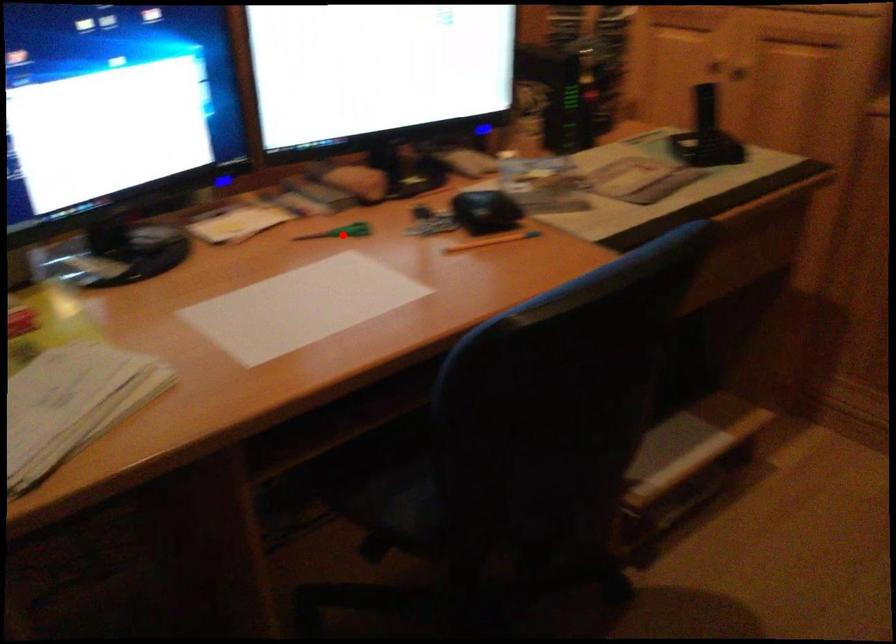
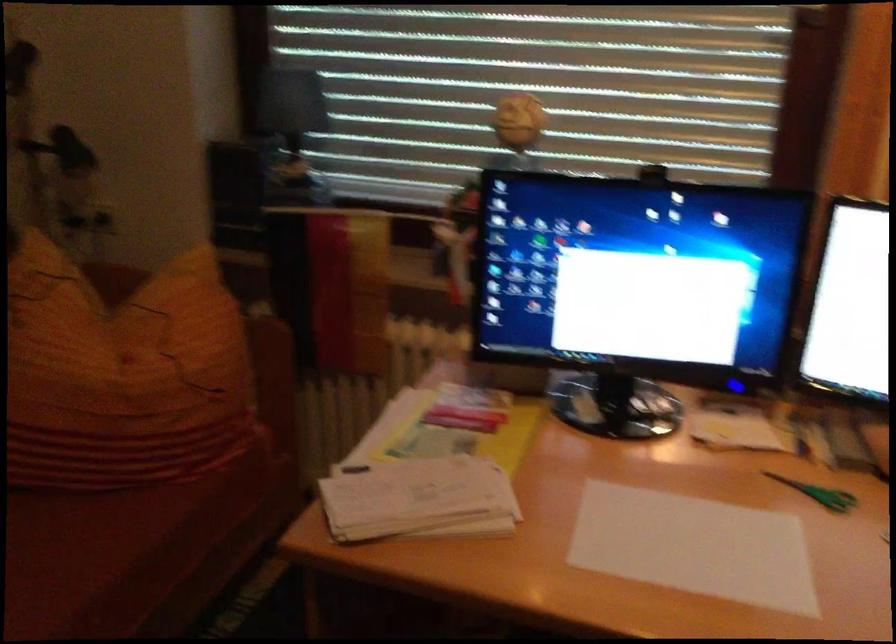
Question: A red point is marked in image1. In image2, is the corresponding 3D point closer to the camera or farther? Reply with the corresponding letter.

Choices:
 (A) The corresponding 3D point is closer.
 (B) The corresponding 3D point is farther.

Answer: (A)